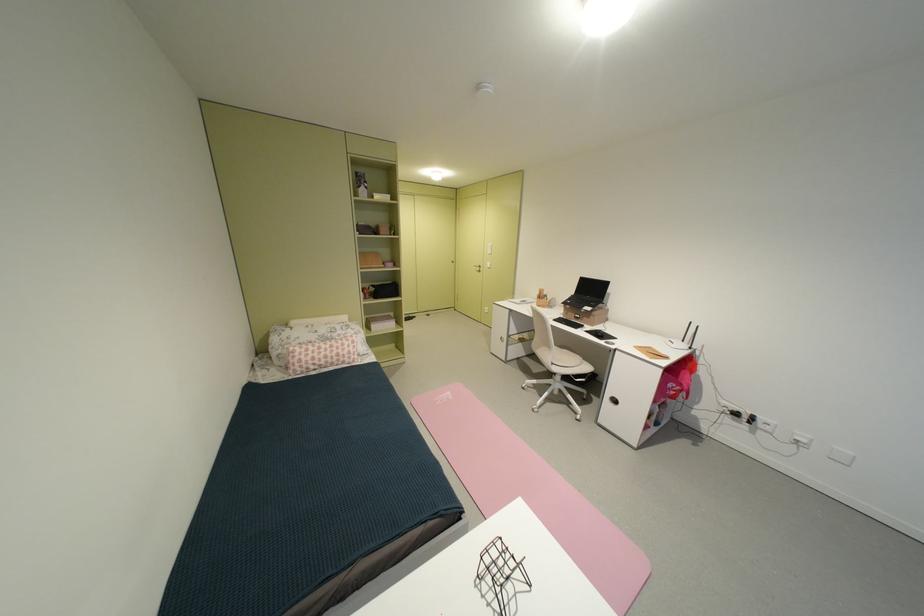
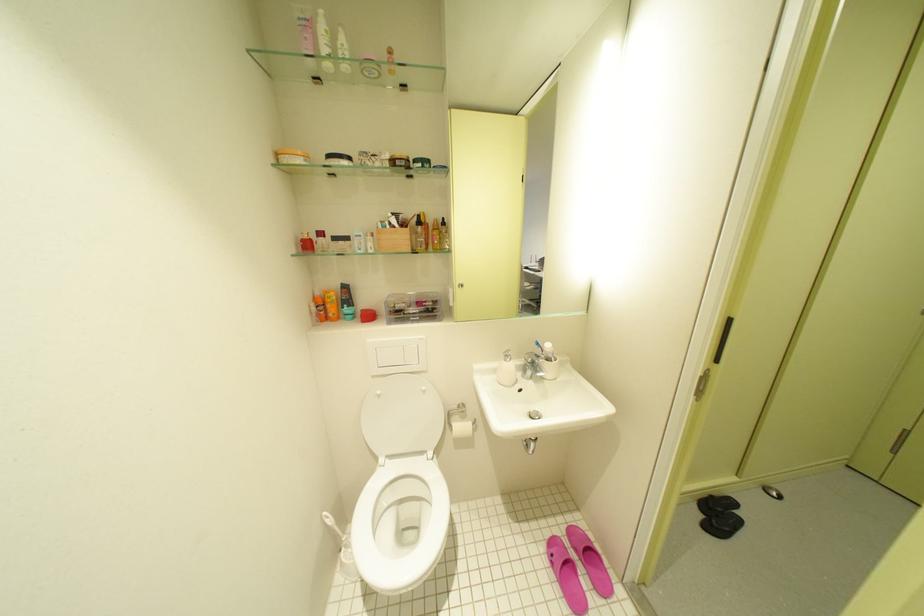
Which direction would the cameraman need to move to produce the second image?

The cameraman walked toward left, forward.